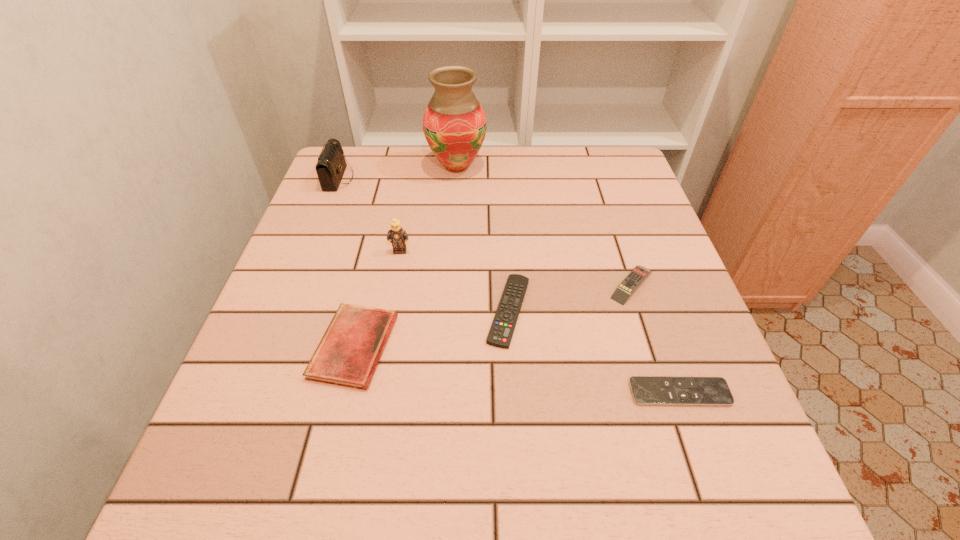
This screenshot has width=960, height=540. I want to click on remote control that stands as the second closest to the shortest object, so 626,288.

What are the coordinates of `free spot that satisfies the following two spatial constraints: 1. on the front side of the tallest remote control; 2. on the right side of the vase` in the screenshot? It's located at (448, 285).

Identify the location of vacant point that satisfies the following two spatial constraints: 1. in front of the shortest remote control; 2. on the left side of the Lego. This screenshot has height=540, width=960. (373, 392).

Where is `free location that satisfies the following two spatial constraints: 1. in front of the Lego; 2. on the left side of the shortest object`? Image resolution: width=960 pixels, height=540 pixels. free location that satisfies the following two spatial constraints: 1. in front of the Lego; 2. on the left side of the shortest object is located at coordinates 373,392.

Locate an element on the screen. free location that satisfies the following two spatial constraints: 1. on the front flap of the diary; 2. on the right side of the leftmost object is located at coordinates (272, 347).

In order to click on vacant space that satisfies the following two spatial constraints: 1. on the front flap of the leftmost object; 2. on the back side of the tallest remote control in this screenshot , I will do `click(297, 285)`.

You are a GUI agent. You are given a task and a screenshot of the screen. Output one action in this format:
    pyautogui.click(x=<x>, y=<y>)
    Task: Click on the vacant region that satisfies the following two spatial constraints: 1. in front of the tallest remote control; 2. on the left side of the Lego
    This screenshot has width=960, height=540.
    Given the screenshot: What is the action you would take?
    pyautogui.click(x=394, y=285)

Where is `free space that satisfies the following two spatial constraints: 1. on the front flap of the clutch bag; 2. on the right side of the sixth tallest object`? This screenshot has height=540, width=960. free space that satisfies the following two spatial constraints: 1. on the front flap of the clutch bag; 2. on the right side of the sixth tallest object is located at coordinates (286, 310).

Where is `vacant region that satisfies the following two spatial constraints: 1. on the front side of the tallest object; 2. on the front flap of the clutch bag`? The width and height of the screenshot is (960, 540). vacant region that satisfies the following two spatial constraints: 1. on the front side of the tallest object; 2. on the front flap of the clutch bag is located at coordinates (456, 178).